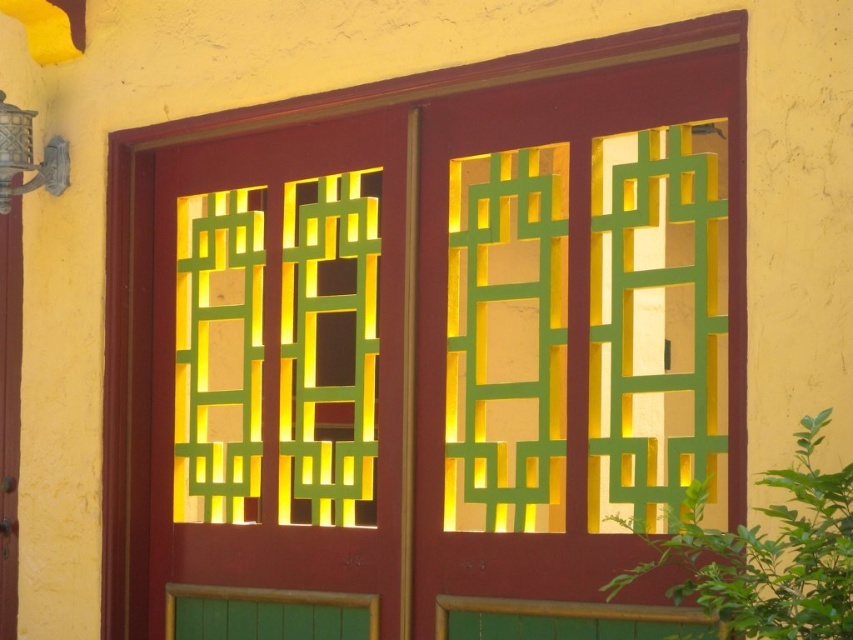
Question: Which point is closer to the camera?

Choices:
 (A) (56, 140)
 (B) (567, 339)

Answer: (B)

Question: Is matte wood screen door at center thinner than metallic wall sconce at upper left?

Choices:
 (A) no
 (B) yes

Answer: (A)

Question: Can you confirm if matte wood screen door at center is positioned above metallic wall sconce at upper left?

Choices:
 (A) no
 (B) yes

Answer: (A)

Question: Can you confirm if matte wood screen door at center is smaller than metallic wall sconce at upper left?

Choices:
 (A) no
 (B) yes

Answer: (A)

Question: Which object is closer to the camera taking this photo?

Choices:
 (A) matte wood screen door at center
 (B) metallic wall sconce at upper left

Answer: (A)